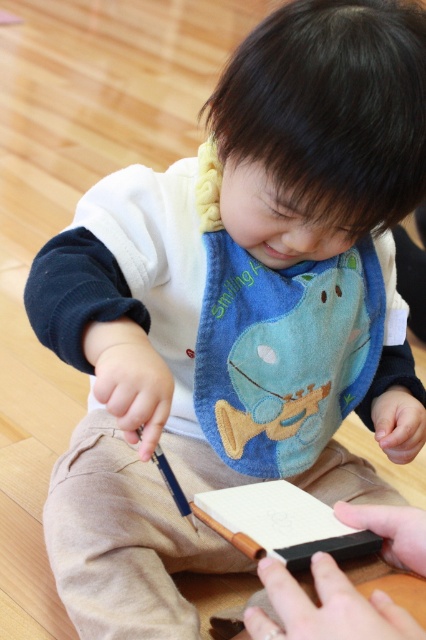
Is white matte notebook at center closer to the viewer compared to black matte pencil at center?

Yes, it is in front of black matte pencil at center.

Does white matte notebook at center have a greater height compared to black matte pencil at center?

Incorrect, white matte notebook at center's height is not larger of black matte pencil at center's.

Who is more forward, (302, 528) or (175, 484)?

Positioned in front is point (302, 528).

Where is `white matte notebook at center`? The image size is (426, 640). white matte notebook at center is located at coordinates click(x=281, y=524).